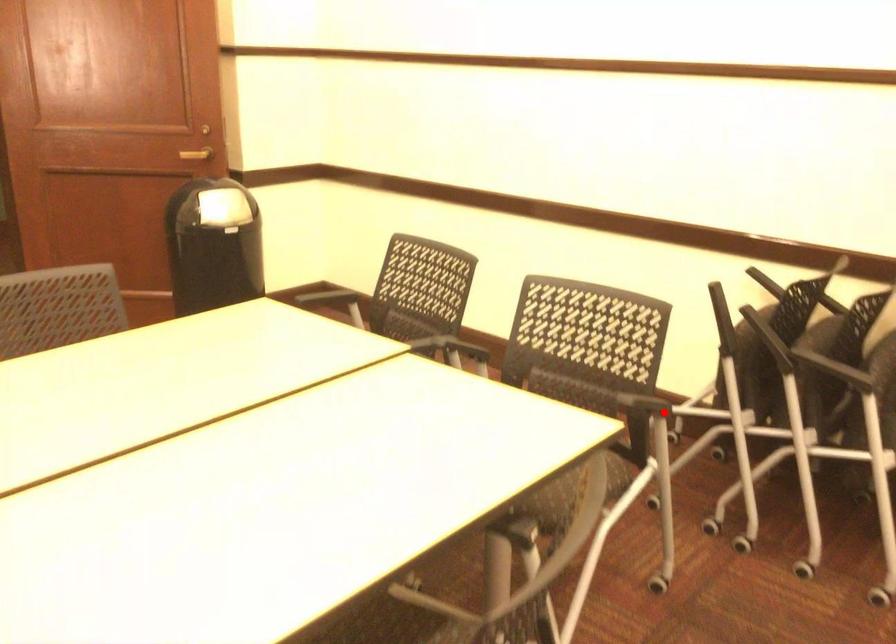
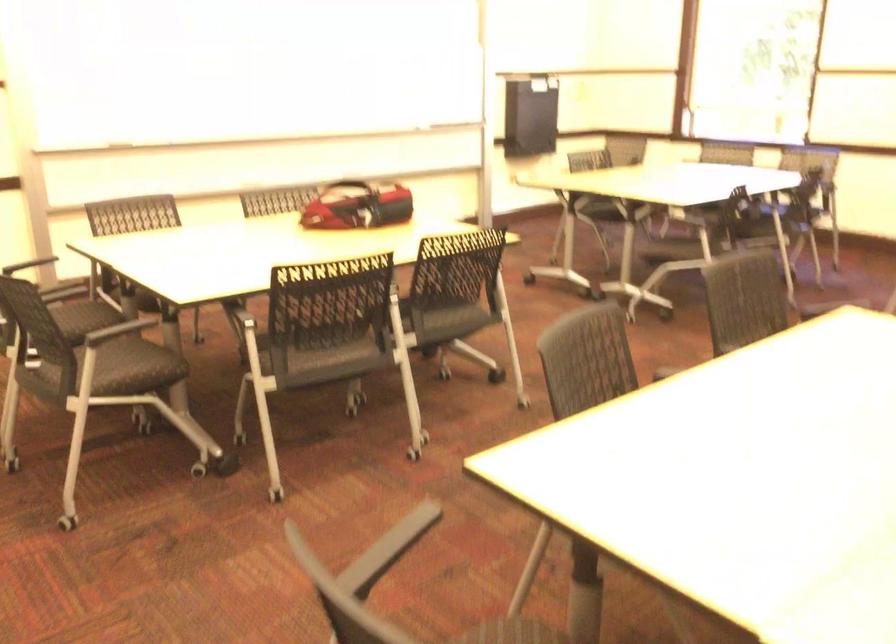
Question: I am providing you with two images of the same scene from different viewpoints. Given a red point in image1, look at the same physical point in image2. Is it:

Choices:
 (A) Closer to the viewpoint
 (B) Farther from the viewpoint

Answer: (A)